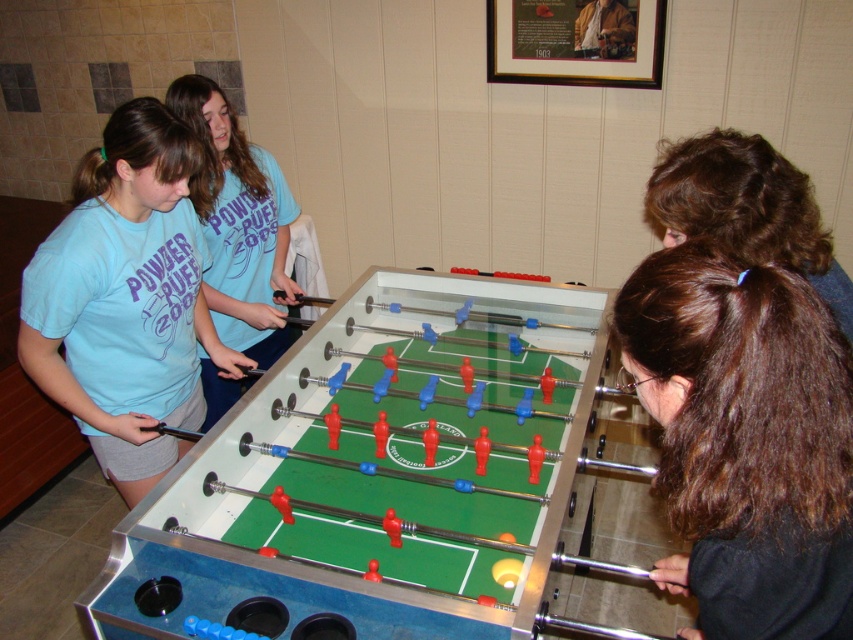
Who is more distant from viewer, (142, 448) or (215, 104)?

Positioned behind is point (215, 104).

Locate an element on the screen. The width and height of the screenshot is (853, 640). matte blue shirt at left is located at coordinates (126, 296).

Does metallic green foosball table at center appear on the left side of light blue cotton shirt at upper left?

No, metallic green foosball table at center is not to the left of light blue cotton shirt at upper left.

Does metallic green foosball table at center come behind light blue cotton shirt at upper left?

No.

Does point (564, 438) come behind point (215, 182)?

No, it is in front of (215, 182).

The width and height of the screenshot is (853, 640). Identify the location of metallic green foosball table at center. (401, 454).

Does point (787, 618) come closer to viewer compared to point (196, 168)?

Yes, point (787, 618) is closer to viewer.

Is brown hair at lower right to the left of matte blue shirt at left from the viewer's perspective?

Incorrect, brown hair at lower right is not on the left side of matte blue shirt at left.

Does point (799, 602) lie in front of point (85, 336)?

Yes, point (799, 602) is closer to viewer.

Find the location of a particular element. The width and height of the screenshot is (853, 640). brown hair at lower right is located at coordinates (746, 440).